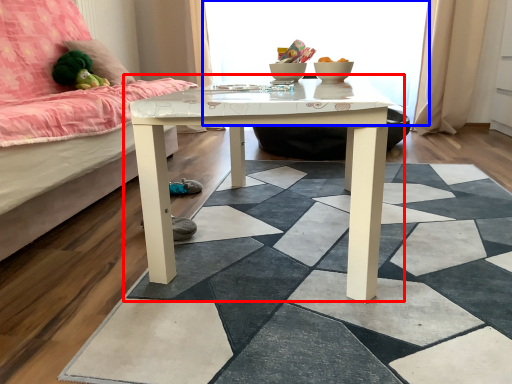
Question: Among these objects, which one is farthest to the camera, table (highlighted by a red box) or window screen (highlighted by a blue box)?

Choices:
 (A) table
 (B) window screen

Answer: (B)